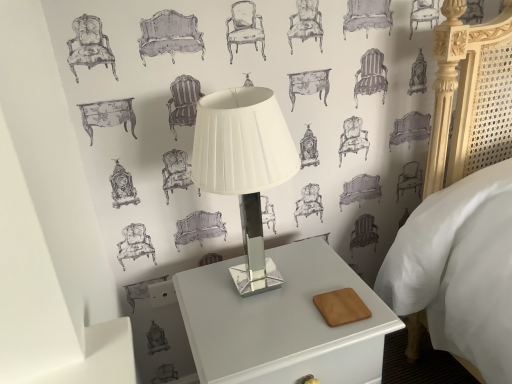
Locate an element on the screen. free location in front of white glossy table lamp at center is located at coordinates (266, 336).